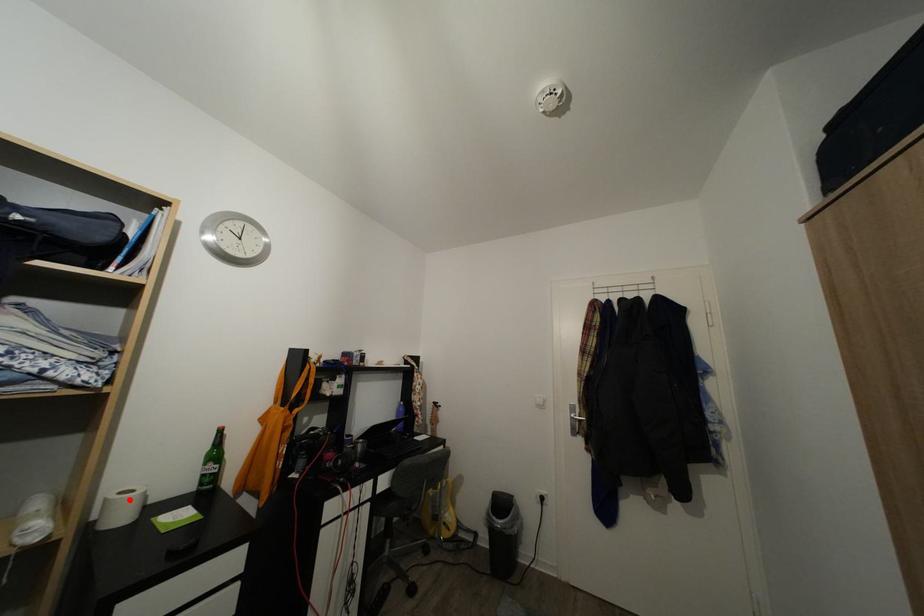
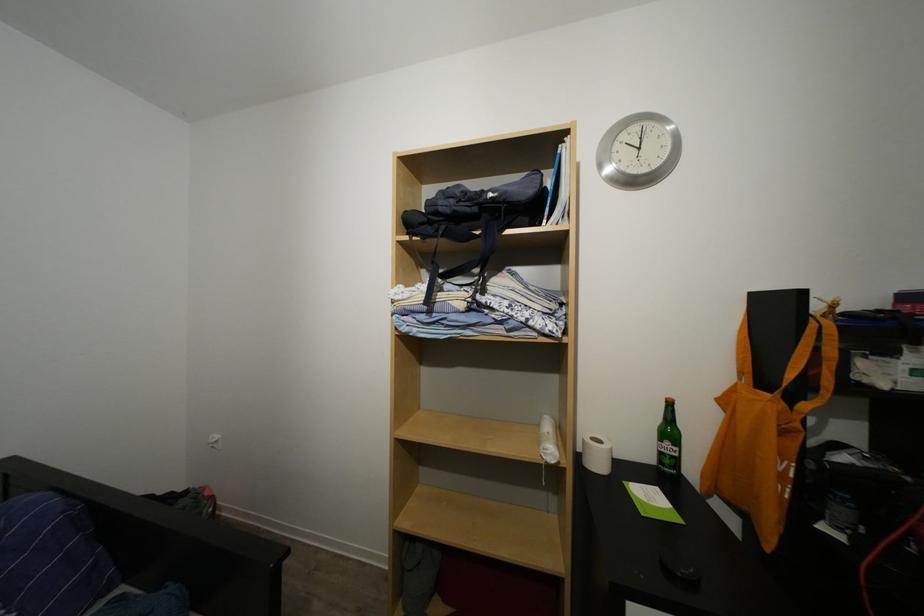
Question: I am providing you with two images of the same scene from different viewpoints. A red point is shown in image1. For the corresponding object point in image2, is it positioned nearer or farther from the camera?

Choices:
 (A) Nearer
 (B) Farther

Answer: (B)